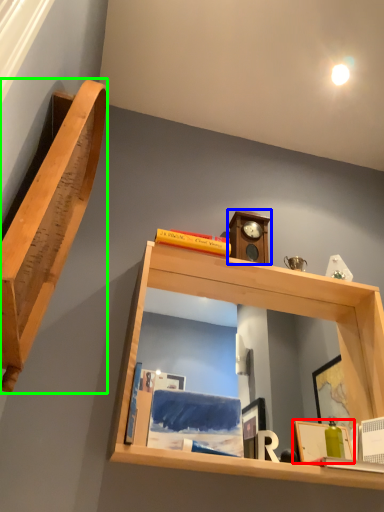
Question: Which object is the closest to the picture frame (highlighted by a red box)? Choose among these: clock (highlighted by a blue box) or shelf (highlighted by a green box).

Choices:
 (A) clock
 (B) shelf

Answer: (A)